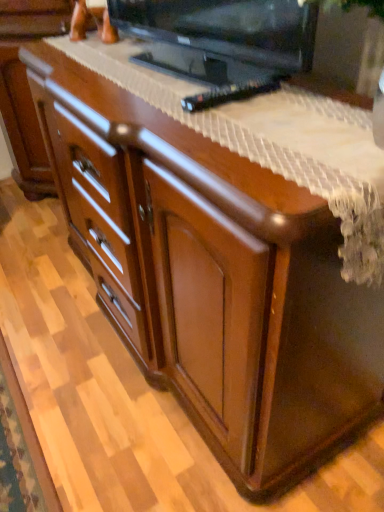
Locate an element on the screen. The width and height of the screenshot is (384, 512). free space in front of black glossy television at upper center is located at coordinates (185, 113).